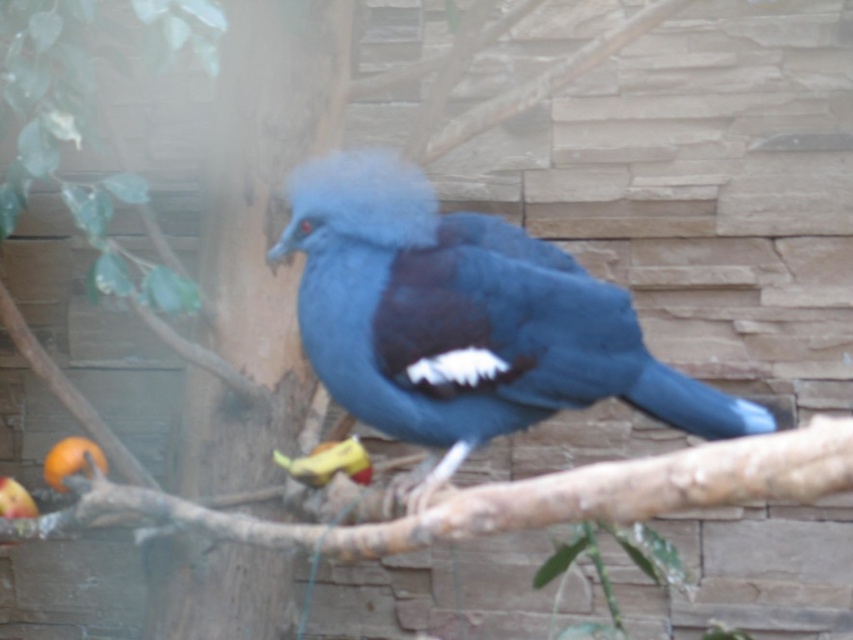
Question: In this image, where is matte blue bird at center located relative to shiny blue parrot at center?

Choices:
 (A) left
 (B) right

Answer: (B)

Question: Which point is farther to the camera?

Choices:
 (A) (645, 515)
 (B) (399, 436)
 (C) (335, 456)
 (D) (54, 467)

Answer: (D)

Question: Where is brown rough wood at lower center located in relation to matte orange fruit at lower left in the image?

Choices:
 (A) left
 (B) right

Answer: (B)

Question: Is matte blue bird at center closer to the viewer compared to shiny blue parrot at center?

Choices:
 (A) yes
 (B) no

Answer: (A)

Question: Which point is closer to the camera?

Choices:
 (A) (689, 481)
 (B) (403, 228)

Answer: (A)

Question: Which point appears farthest from the camera in this image?

Choices:
 (A) (102, 454)
 (B) (347, 362)

Answer: (A)